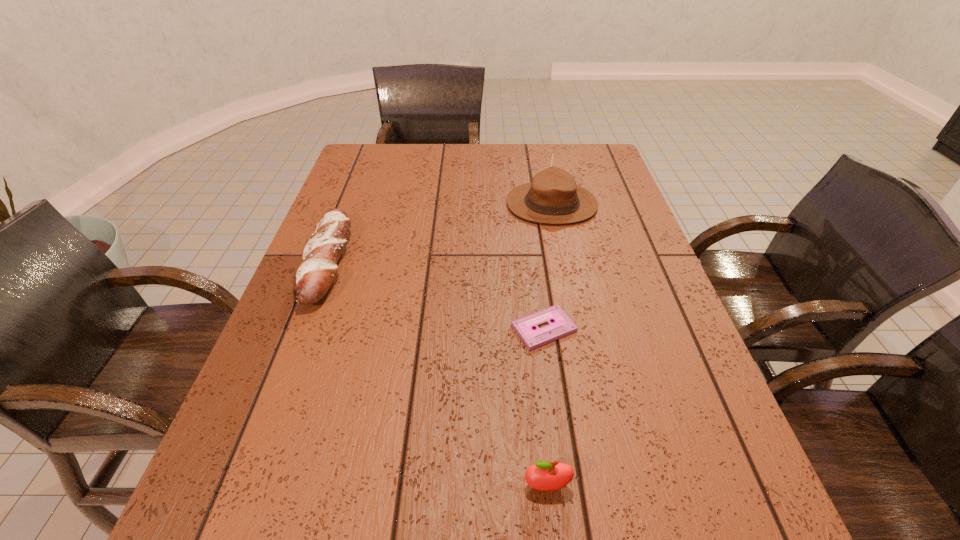
Where is `the tallest object`? The image size is (960, 540). the tallest object is located at coordinates (553, 197).

Locate an element on the screen. apple is located at coordinates (545, 476).

Locate an element on the screen. the third tallest object is located at coordinates (315, 274).

Locate an element on the screen. The width and height of the screenshot is (960, 540). baguet is located at coordinates (315, 274).

Find the location of `videotape`. videotape is located at coordinates (562, 325).

At what (x,y) coordinates should I click in order to perform the action: click on free space located 0.310m on the feather side of the fedora. Please return your answer as a coordinate pair (x, y). Image resolution: width=960 pixels, height=540 pixels. Looking at the image, I should click on (401, 204).

I want to click on blank space located 0.080m on the feather side of the fedora, so click(x=479, y=204).

Identify the location of blank space located on the feather side of the fedora. The height and width of the screenshot is (540, 960). (483, 204).

I want to click on vacant space located 0.100m on the back of the apple, so click(x=540, y=420).

This screenshot has height=540, width=960. Identify the location of vacant space positioned 0.050m on the right of the leftmost object. (367, 262).